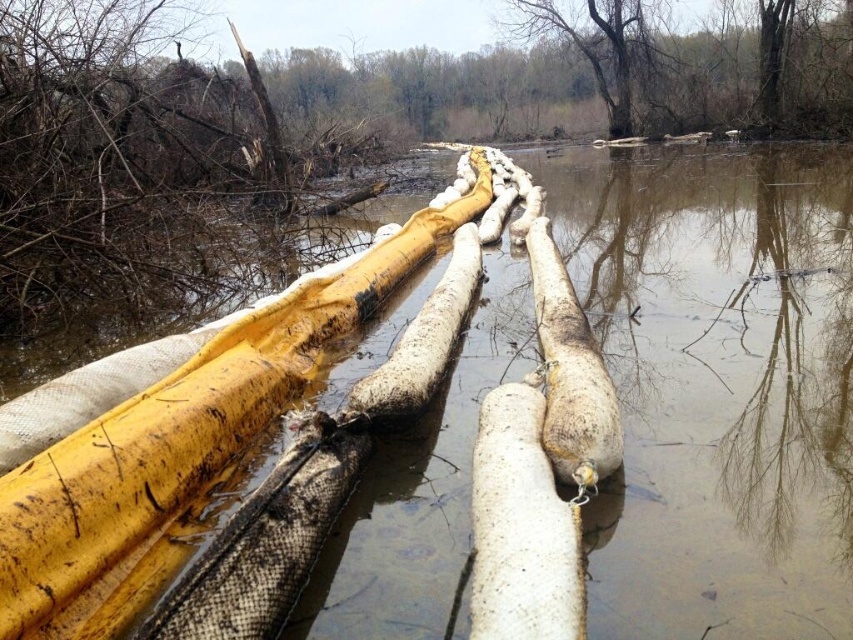
Question: Is white rough log at center positioned in front of brown bark tree at upper center?

Choices:
 (A) no
 (B) yes

Answer: (B)

Question: Can you confirm if white rough log at center is smaller than brown bark tree at upper center?

Choices:
 (A) yes
 (B) no

Answer: (B)

Question: From the image, what is the correct spatial relationship of white rough log at center in relation to brown bark tree at upper center?

Choices:
 (A) right
 (B) left

Answer: (B)

Question: Among these points, which one is nearest to the camera?

Choices:
 (A) (653, 84)
 (B) (506, 582)

Answer: (B)

Question: Which point is closer to the camera?

Choices:
 (A) (561, 534)
 (B) (610, 93)

Answer: (A)

Question: Which of the following is the closest to the observer?

Choices:
 (A) white rough log at center
 (B) brown bark tree at upper center

Answer: (A)